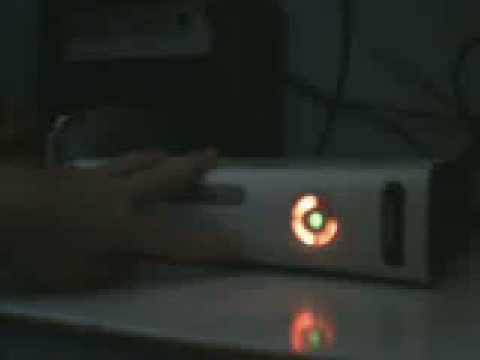
In order to click on electric device in this screenshot , I will do `click(239, 216)`.